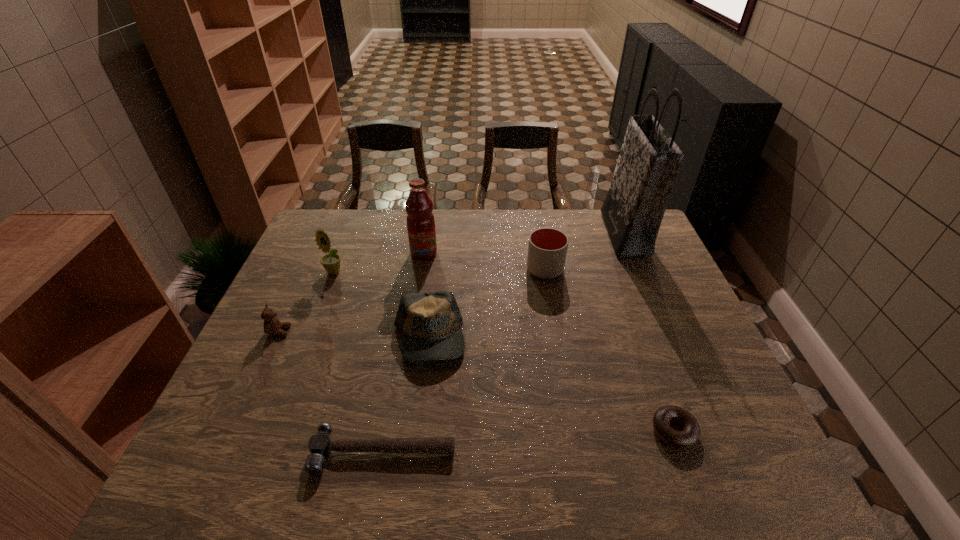
In the image, there is a desktop. Identify the location of vacant space at the near edge. Image resolution: width=960 pixels, height=540 pixels. coord(648,485).

You are a GUI agent. You are given a task and a screenshot of the screen. Output one action in this format:
    pyautogui.click(x=<x>, y=<y>)
    Task: Click on the vacant area at the left edge of the desktop
    
    Given the screenshot: What is the action you would take?
    pyautogui.click(x=304, y=285)

Where is `free region at the right edge of the desktop`? free region at the right edge of the desktop is located at coordinates (664, 330).

Find the location of `free spot at the far left corner of the desktop`. free spot at the far left corner of the desktop is located at coordinates (358, 223).

The height and width of the screenshot is (540, 960). Find the location of `vacant space at the near left corner of the desktop`. vacant space at the near left corner of the desktop is located at coordinates (217, 450).

You are a GUI agent. You are given a task and a screenshot of the screen. Output one action in this format:
    pyautogui.click(x=<x>, y=<y>)
    Task: Click on the vacant space that is in between the tallest object and the baseball cap
    The height and width of the screenshot is (540, 960).
    Given the screenshot: What is the action you would take?
    pyautogui.click(x=527, y=286)

Where is `empty space between the second tallest object and the teddy bear`? Image resolution: width=960 pixels, height=540 pixels. empty space between the second tallest object and the teddy bear is located at coordinates click(x=351, y=292).

The height and width of the screenshot is (540, 960). In order to click on unoccupied position between the doughnut and the baseball cap in this screenshot , I will do `click(551, 385)`.

I want to click on vacant space that is in between the sixth shortest object and the baseball cap, so click(x=381, y=306).

Find the location of a particular element. free space between the cup and the doughnut is located at coordinates (610, 350).